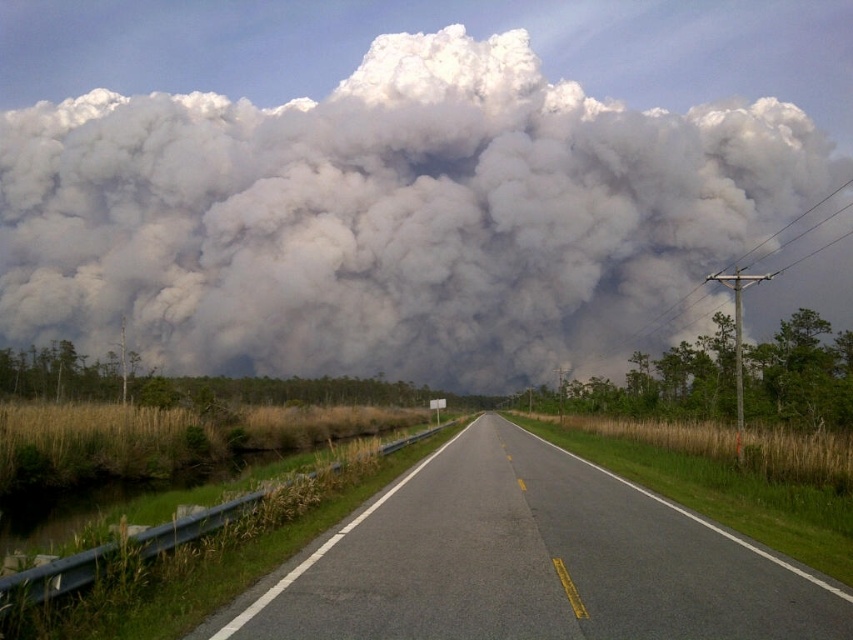
Does white fluffy cloud at upper center have a lesser width compared to asphalt road at center?

Incorrect, white fluffy cloud at upper center's width is not less than asphalt road at center's.

Measure the distance between white fluffy cloud at upper center and asphalt road at center.

white fluffy cloud at upper center and asphalt road at center are 436.46 feet apart from each other.

Is point (654, 305) closer to camera compared to point (599, 488)?

No, (654, 305) is further to viewer.

Find the location of a particular element. The width and height of the screenshot is (853, 640). white fluffy cloud at upper center is located at coordinates (387, 216).